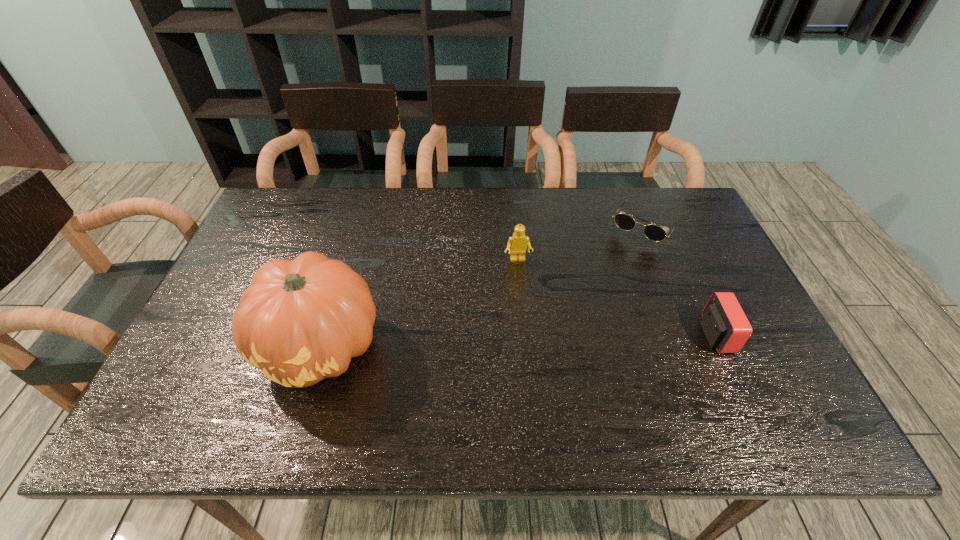
Where is `the tallest object`? This screenshot has width=960, height=540. the tallest object is located at coordinates (301, 321).

You are a GUI agent. You are given a task and a screenshot of the screen. Output one action in this format:
    pyautogui.click(x=<x>, y=<y>)
    Task: Click on the pumpkin
    This screenshot has height=540, width=960.
    Given the screenshot: What is the action you would take?
    pyautogui.click(x=301, y=321)

What are the coordinates of `alarm clock` in the screenshot? It's located at (726, 327).

Identify the location of the third object from right to left. (518, 242).

Identify the location of Lego. (518, 242).

The height and width of the screenshot is (540, 960). I want to click on sunglasses, so click(655, 233).

Locate an element on the screen. vacant space situated on the front-facing side of the alarm clock is located at coordinates (764, 335).

Find the location of `vacant space situated 0.100m on the face of the Lego`. vacant space situated 0.100m on the face of the Lego is located at coordinates (523, 291).

Locate an element on the screen. Image resolution: width=960 pixels, height=540 pixels. vacant space situated on the face of the Lego is located at coordinates (539, 390).

At what (x,y) coordinates should I click in order to perform the action: click on vacant space located 0.380m on the face of the Lego. Please return your answer as a coordinate pair (x, y). Image resolution: width=960 pixels, height=540 pixels. Looking at the image, I should click on (538, 382).